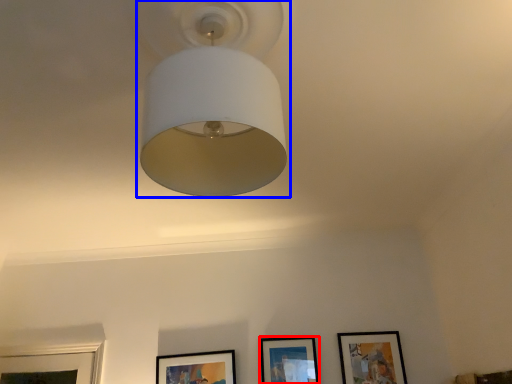
Question: Which of the following is the farthest to the observer, picture frame (highlighted by a red box) or lamp (highlighted by a blue box)?

Choices:
 (A) picture frame
 (B) lamp

Answer: (A)